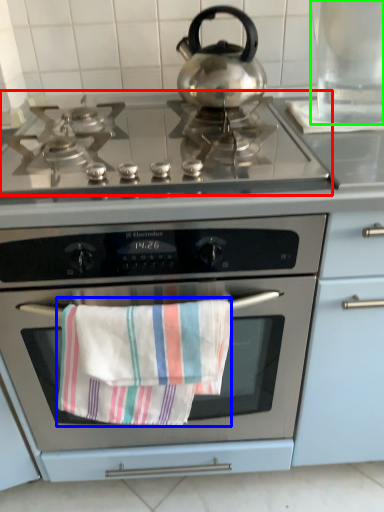
Question: Which object is the farthest from gas stove (highlighted by a red box)? Choose among these: beach towel (highlighted by a blue box) or appliance (highlighted by a green box).

Choices:
 (A) beach towel
 (B) appliance

Answer: (A)